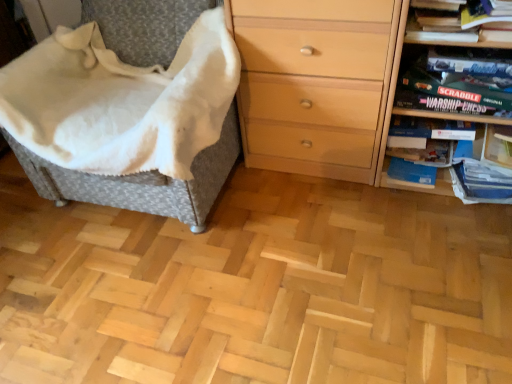
Question: Should I look upward or downward to see wooden board game at right?

Choices:
 (A) down
 (B) up

Answer: (B)

Question: Does woven fabric chair at left have a smaller size compared to wooden board game at right?

Choices:
 (A) no
 (B) yes

Answer: (A)

Question: From a real-world perspective, is woven fabric chair at left physically below wooden board game at right?

Choices:
 (A) no
 (B) yes

Answer: (A)

Question: Considering the relative sizes of woven fabric chair at left and wooden board game at right in the image provided, is woven fabric chair at left thinner than wooden board game at right?

Choices:
 (A) yes
 (B) no

Answer: (B)

Question: Is woven fabric chair at left outside of wooden board game at right?

Choices:
 (A) no
 (B) yes

Answer: (B)

Question: Does woven fabric chair at left lie behind wooden board game at right?

Choices:
 (A) no
 (B) yes

Answer: (A)

Question: Is woven fabric chair at left at the left side of wooden board game at right?

Choices:
 (A) no
 (B) yes

Answer: (B)

Question: From a real-world perspective, does wooden board game at right sit lower than matte black game box at upper right?

Choices:
 (A) yes
 (B) no

Answer: (A)

Question: From the image's perspective, is wooden board game at right above matte black game box at upper right?

Choices:
 (A) yes
 (B) no

Answer: (B)

Question: Is wooden board game at right taller than matte black game box at upper right?

Choices:
 (A) yes
 (B) no

Answer: (A)

Question: Is wooden board game at right looking in the opposite direction of matte black game box at upper right?

Choices:
 (A) no
 (B) yes

Answer: (A)

Question: Is wooden board game at right surrounding matte black game box at upper right?

Choices:
 (A) yes
 (B) no

Answer: (B)

Question: Is the position of wooden board game at right less distant than that of matte black game box at upper right?

Choices:
 (A) yes
 (B) no

Answer: (B)

Question: Is the depth of light wood chest of drawers at right less than that of woven fabric chair at left?

Choices:
 (A) no
 (B) yes

Answer: (A)